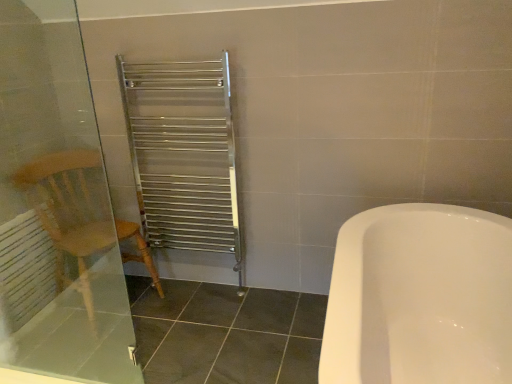
Question: From the image's perspective, would you say transparent glass screen door at left is positioned over white matte radiator at left?

Choices:
 (A) yes
 (B) no

Answer: (A)

Question: Is transparent glass screen door at left positioned far away from white matte radiator at left?

Choices:
 (A) yes
 (B) no

Answer: (B)

Question: From a real-world perspective, does transparent glass screen door at left stand above white matte radiator at left?

Choices:
 (A) no
 (B) yes

Answer: (B)

Question: From the image's perspective, would you say transparent glass screen door at left is shown under white matte radiator at left?

Choices:
 (A) yes
 (B) no

Answer: (B)

Question: Considering the relative sizes of transparent glass screen door at left and white matte radiator at left in the image provided, is transparent glass screen door at left shorter than white matte radiator at left?

Choices:
 (A) yes
 (B) no

Answer: (B)

Question: Looking at their shapes, would you say wooden armchair at left is wider or thinner than transparent glass screen door at left?

Choices:
 (A) wide
 (B) thin

Answer: (A)

Question: Is wooden armchair at left spatially inside transparent glass screen door at left, or outside of it?

Choices:
 (A) inside
 (B) outside

Answer: (B)

Question: In terms of height, does wooden armchair at left look taller or shorter compared to transparent glass screen door at left?

Choices:
 (A) tall
 (B) short

Answer: (B)

Question: Would you say wooden armchair at left is to the left or to the right of transparent glass screen door at left in the picture?

Choices:
 (A) right
 (B) left

Answer: (B)

Question: From the image's perspective, is white matte radiator at left located above or below transparent glass screen door at left?

Choices:
 (A) below
 (B) above

Answer: (A)

Question: Is white matte radiator at left wider or thinner than transparent glass screen door at left?

Choices:
 (A) thin
 (B) wide

Answer: (B)

Question: Does point 31,276 appear closer or farther from the camera than point 90,365?

Choices:
 (A) farther
 (B) closer

Answer: (A)

Question: Considering the positions of white matte radiator at left and transparent glass screen door at left in the image, is white matte radiator at left taller or shorter than transparent glass screen door at left?

Choices:
 (A) tall
 (B) short

Answer: (B)

Question: From their relative heights in the image, would you say white matte radiator at left is taller or shorter than wooden armchair at left?

Choices:
 (A) short
 (B) tall

Answer: (A)

Question: From the image's perspective, is white matte radiator at left above or below wooden armchair at left?

Choices:
 (A) above
 (B) below

Answer: (B)